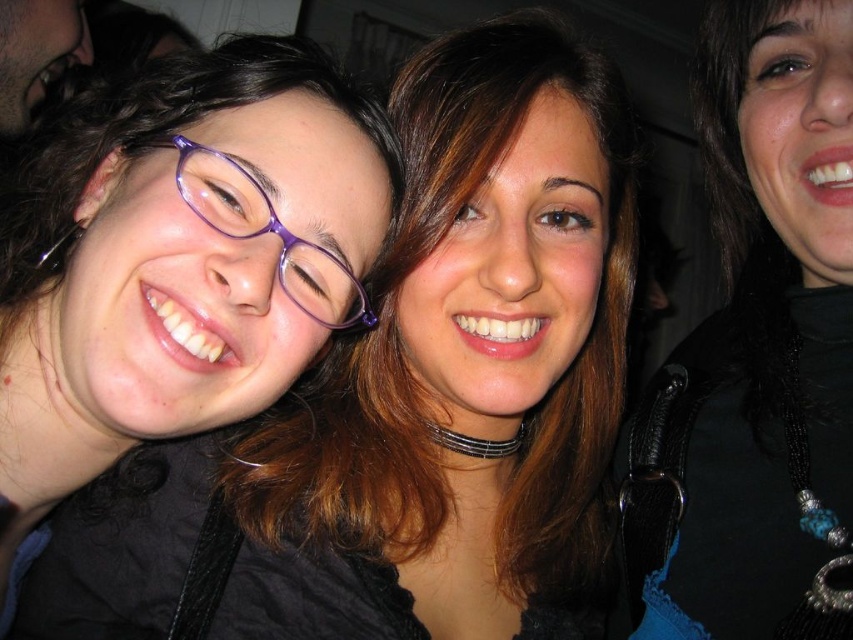
Can you confirm if matte black jacket at center is bigger than black beaded necklace at upper right?

Indeed, matte black jacket at center has a larger size compared to black beaded necklace at upper right.

Which is in front, point (351, 365) or point (701, 364)?

Point (351, 365) is in front.

I want to click on matte black jacket at center, so click(410, 403).

Where is `matte black jacket at center`? matte black jacket at center is located at coordinates (410, 403).